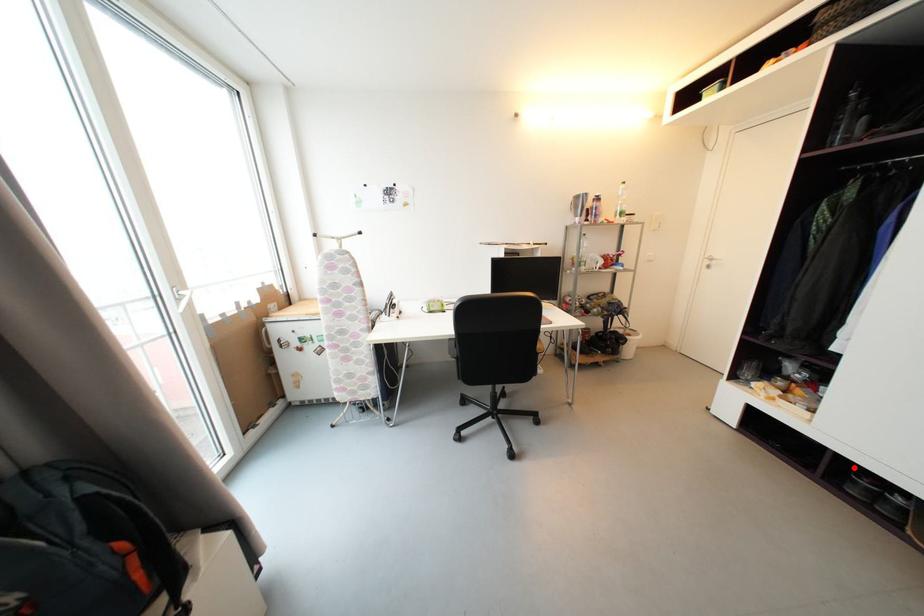
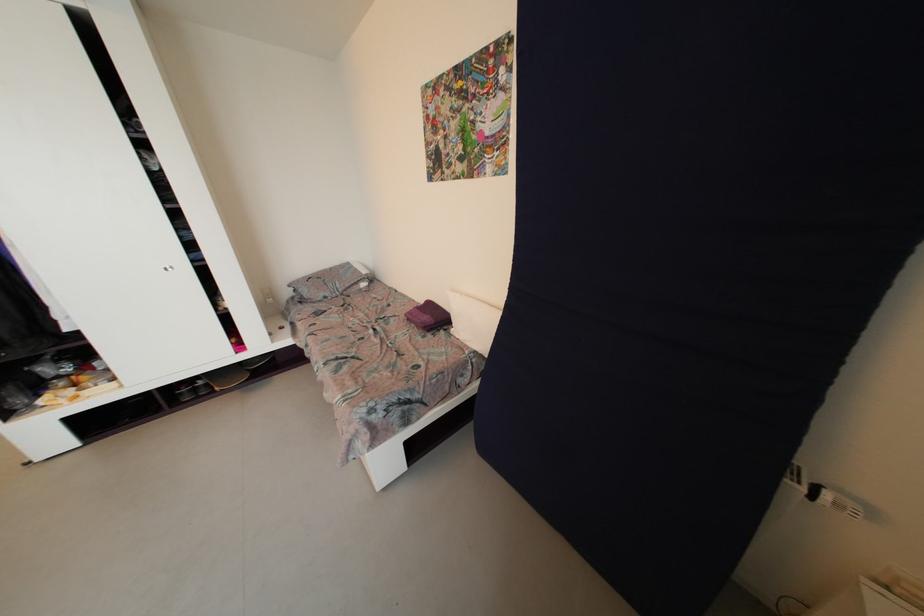
Question: I am providing you with two images of the same scene from different viewpoints. Given a red point in image1, look at the same physical point in image2. Is it:

Choices:
 (A) Closer to the viewpoint
 (B) Farther from the viewpoint

Answer: (A)